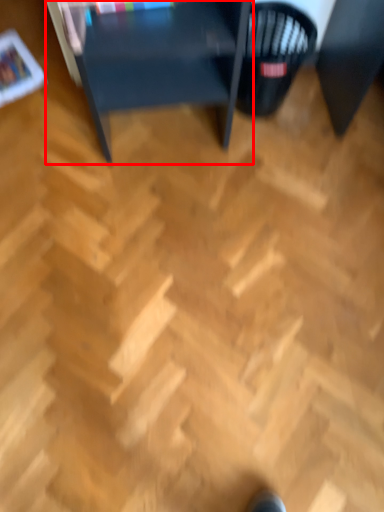
Question: From the image's perspective, where is table (annotated by the red box) located in relation to basket in the image?

Choices:
 (A) below
 (B) above

Answer: (B)